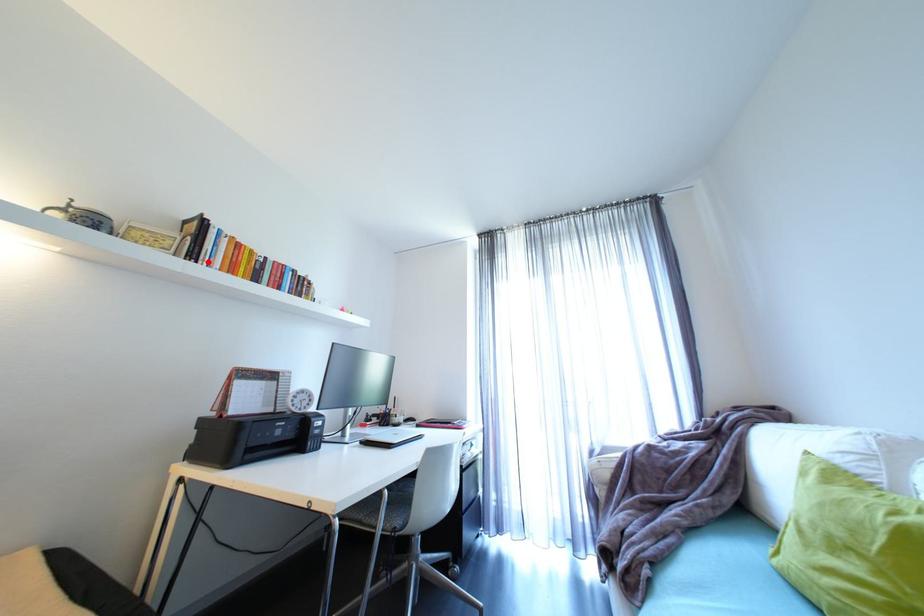
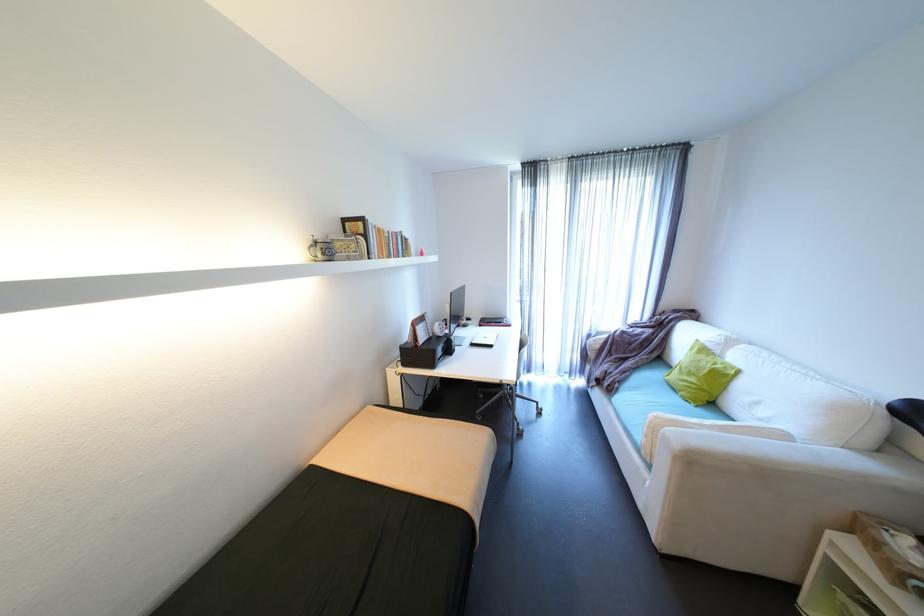
Locate, in the second image, the point that corresponds to the highlighted location in the first image.

(380, 254)